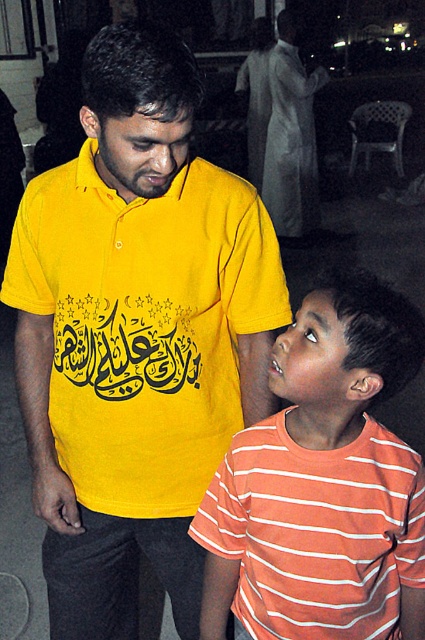
At what (x,y) coordinates should I click in order to perform the action: click on matte yellow polo shirt at center. Please return your answer as a coordinate pair (x, y). This screenshot has width=425, height=640. Looking at the image, I should click on (144, 324).

Who is more distant from viewer, (79, 218) or (286, 38)?

The point (286, 38) is more distant.

Who is more forward, (50, 188) or (294, 106)?

Positioned in front is point (50, 188).

The height and width of the screenshot is (640, 425). I want to click on matte yellow polo shirt at center, so click(x=144, y=324).

Between orange striped shirt at lower right and matte yellow shirt at center, which one appears on the right side from the viewer's perspective?

matte yellow shirt at center is more to the right.

Is orange striped shirt at lower right above matte yellow shirt at center?

No.

Does point (257, 529) lie in front of point (305, 83)?

Yes, point (257, 529) is closer to viewer.

In order to click on orange striped shirt at lower right in this screenshot , I will do `click(323, 483)`.

Based on the photo, is black calligraphy at center bigger than matte yellow shirt at center?

No.

Can you confirm if black calligraphy at center is positioned above matte yellow shirt at center?

Actually, black calligraphy at center is below matte yellow shirt at center.

Locate an element on the screen. The width and height of the screenshot is (425, 640). black calligraphy at center is located at coordinates (125, 344).